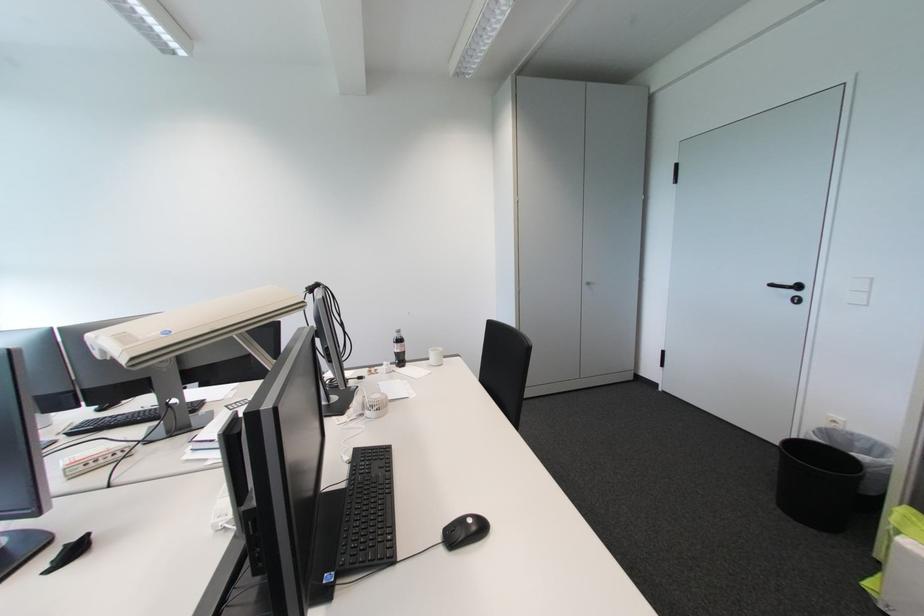
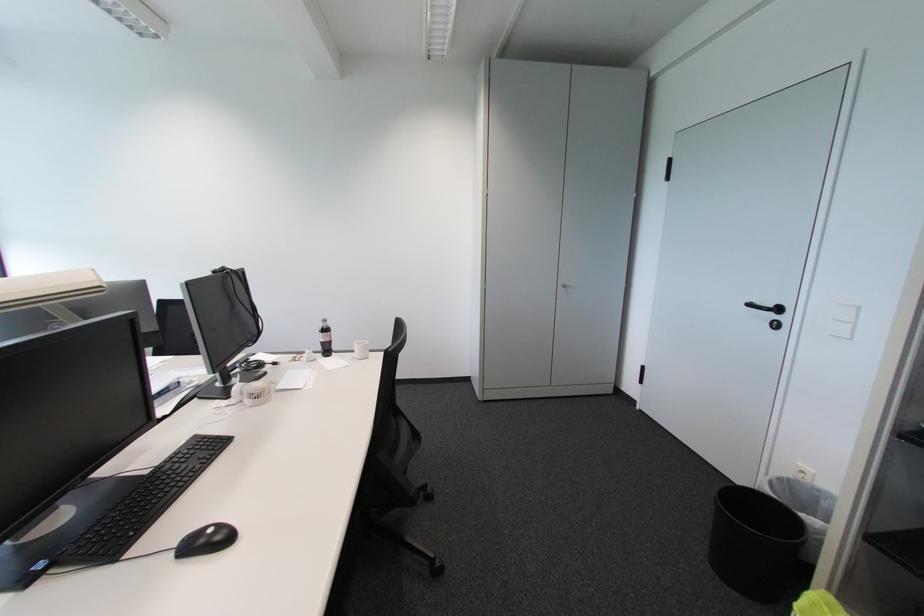
In the second image, find the point that corresponds to (x=786, y=513) in the first image.

(714, 565)